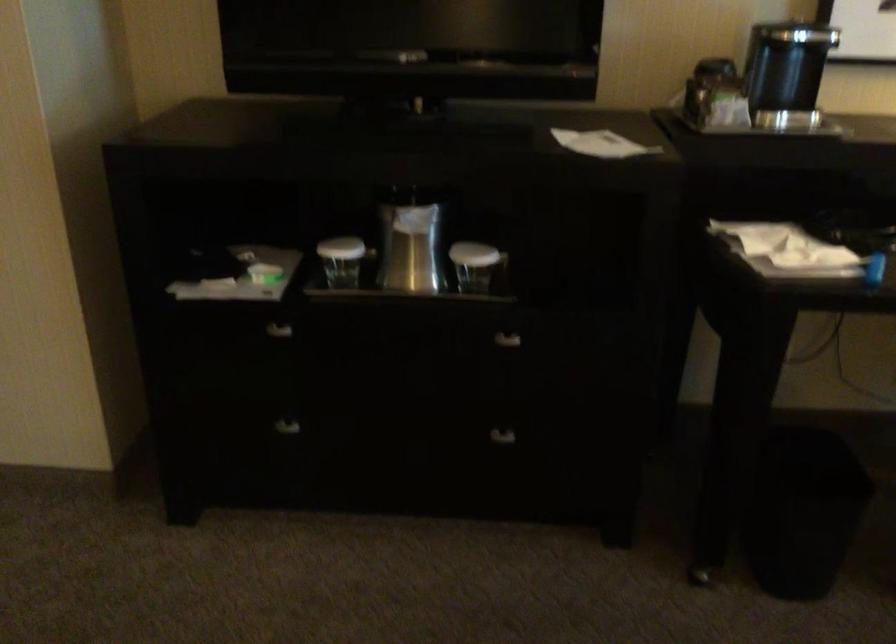
This screenshot has width=896, height=644. What are the coordinates of `desk caster wheel` in the screenshot? It's located at (701, 574).